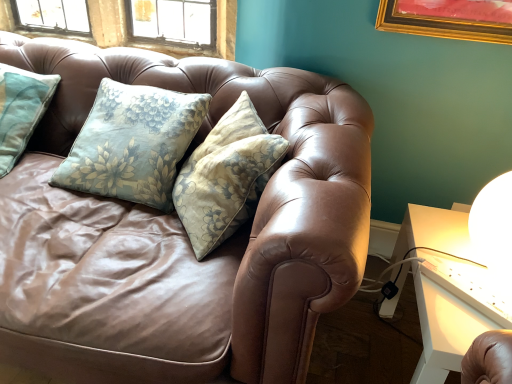
Question: From their relative heights in the image, would you say brown leather couch at center is taller or shorter than white glossy table at right?

Choices:
 (A) tall
 (B) short

Answer: (A)

Question: Would you say brown leather couch at center is inside or outside white glossy table at right?

Choices:
 (A) inside
 (B) outside

Answer: (B)

Question: Would you say brown leather couch at center is to the left or to the right of white glossy table at right in the picture?

Choices:
 (A) left
 (B) right

Answer: (A)

Question: Is white glossy table at right inside the boundaries of brown leather couch at center, or outside?

Choices:
 (A) inside
 (B) outside

Answer: (B)

Question: Is white glossy table at right wider or thinner than brown leather couch at center?

Choices:
 (A) wide
 (B) thin

Answer: (B)

Question: Relative to brown leather couch at center, is white glossy table at right in front or behind?

Choices:
 (A) front
 (B) behind

Answer: (B)

Question: From the image's perspective, is white glossy table at right positioned above or below brown leather couch at center?

Choices:
 (A) above
 (B) below

Answer: (B)